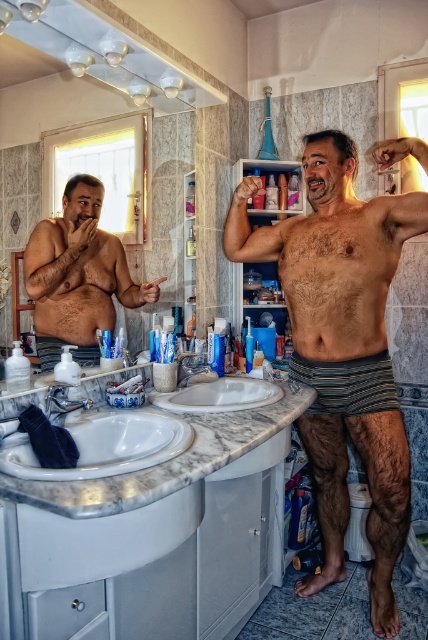
Question: Is striped cotton shorts at center to the left of matte black torso at left from the viewer's perspective?

Choices:
 (A) no
 (B) yes

Answer: (A)

Question: Which of the following is the closest to the observer?

Choices:
 (A) matte black torso at left
 (B) white glossy sink at lower left
 (C) striped cotton shorts at center

Answer: (B)

Question: Is matte black torso at left above white glossy sink at lower left?

Choices:
 (A) no
 (B) yes

Answer: (B)

Question: Which point appears farthest from the camera in this image?

Choices:
 (A) (38, 253)
 (B) (97, 474)
 (C) (323, 134)

Answer: (C)

Question: Does striped cotton shorts at center have a lesser width compared to white glossy sink at lower left?

Choices:
 (A) no
 (B) yes

Answer: (A)

Question: Which object is the closest to the matte black torso at left?

Choices:
 (A) striped cotton shorts at center
 (B) white glossy sink at lower left

Answer: (B)